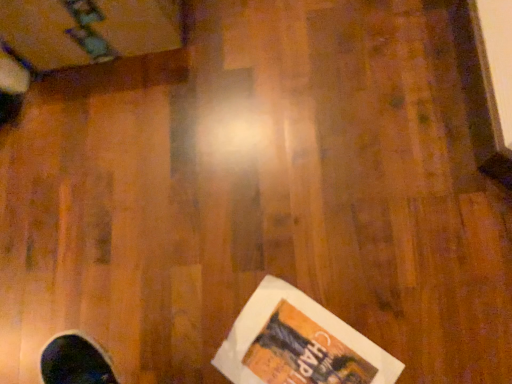
Locate an element on the screen. This screenshot has height=384, width=512. free space above white paper flyer at lower right (from a real-world perspective) is located at coordinates (295, 344).